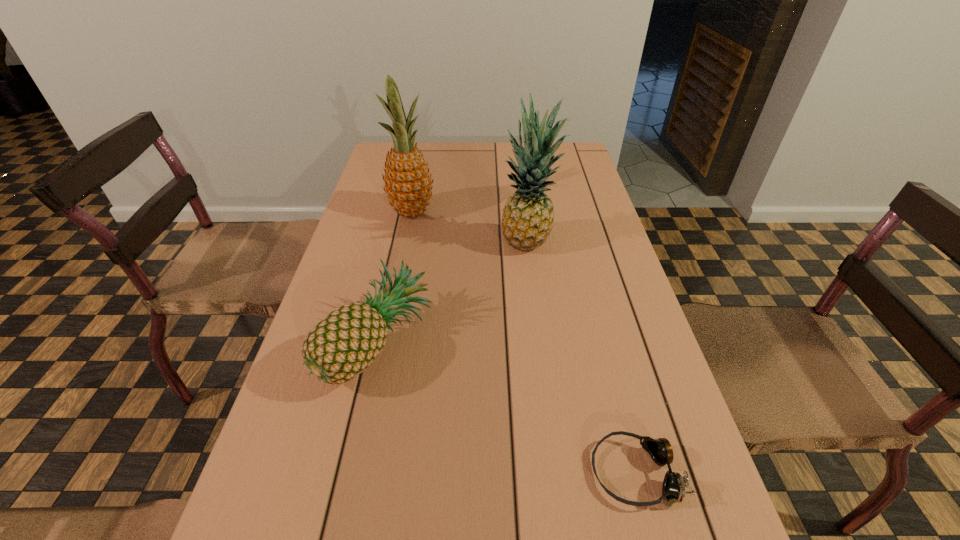
This screenshot has height=540, width=960. What are the coordinates of `free space between the nearest object and the shortest pineapple` in the screenshot? It's located at (507, 408).

You are a GUI agent. You are given a task and a screenshot of the screen. Output one action in this format:
    pyautogui.click(x=<x>, y=<y>)
    Task: Click on the free space between the goggles and the second farthest pineapple
    
    Given the screenshot: What is the action you would take?
    pyautogui.click(x=581, y=359)

Image resolution: width=960 pixels, height=540 pixels. Find the location of `unoccupied position between the farthest pineapple and the nearest object`. unoccupied position between the farthest pineapple and the nearest object is located at coordinates (523, 342).

At what (x,y) coordinates should I click in order to perform the action: click on object that stands as the closest to the farthest pineapple. Please return your answer as a coordinate pair (x, y). This screenshot has height=540, width=960. Looking at the image, I should click on click(x=528, y=216).

Locate an element on the screen. This screenshot has width=960, height=540. the closest object to the third tallest object is located at coordinates (528, 216).

Locate an element on the screen. Image resolution: width=960 pixels, height=540 pixels. pineapple that is the nearest to the second farthest object is located at coordinates (408, 184).

Select which pineapple appears as the second closest to the second farthest object. Please provide its 2D coordinates. Your answer should be formatted as a tuple, i.e. [(x, y)], where the tuple contains the x and y coordinates of a point satisfying the conditions above.

[(340, 347)]